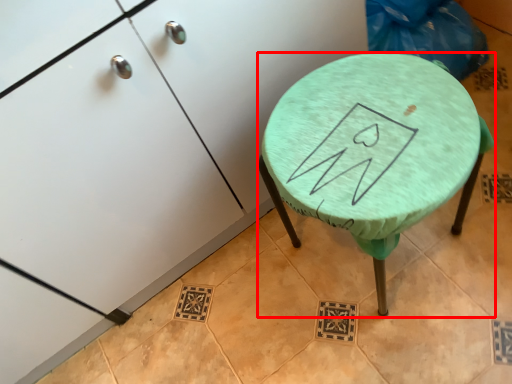
Question: From the image's perspective, what is the correct spatial relationship of stool (annotated by the red box) in relation to furniture?

Choices:
 (A) below
 (B) above

Answer: (A)